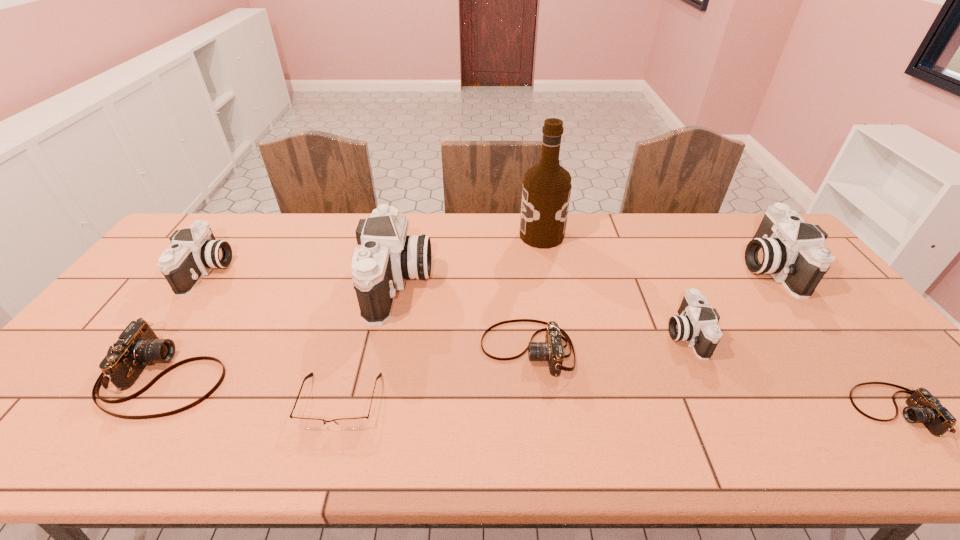
The height and width of the screenshot is (540, 960). Find the location of `vacant space situated on the front of the rightmost black camera`. vacant space situated on the front of the rightmost black camera is located at coordinates 812,324.

This screenshot has height=540, width=960. Find the location of `free space located on the right of the leftmost black camera`. free space located on the right of the leftmost black camera is located at coordinates (279, 272).

Identify the location of free space located 0.390m on the back of the fourth tallest camera. (637, 231).

You are a GUI agent. You are given a task and a screenshot of the screen. Output one action in this format:
    pyautogui.click(x=<x>, y=<y>)
    Task: Click on the vacant space located on the front-facing side of the leftmost brown camera
    The image size is (960, 540).
    Given the screenshot: What is the action you would take?
    pyautogui.click(x=295, y=375)

Identify the location of free space located 0.260m on the front-facing side of the third shortest object. This screenshot has height=540, width=960. (381, 349).

This screenshot has height=540, width=960. What are the coordinates of `vacant space located 0.290m on the front-facing side of the third shortest object` in the screenshot? It's located at (370, 349).

Locate an element on the screen. The image size is (960, 540). vacant region located on the front-facing side of the third shortest object is located at coordinates (416, 349).

You are a GUI agent. You are given a task and a screenshot of the screen. Output one action in this format:
    pyautogui.click(x=<x>, y=<y>)
    Task: Click on the vacant region located 0.060m on the front-facing side of the black spectacles
    Image resolution: width=960 pixels, height=540 pixels.
    Given the screenshot: What is the action you would take?
    pyautogui.click(x=324, y=457)

I want to click on alcohol present at the far edge, so click(x=546, y=191).

At what (x,y) coordinates should I click in order to perform the action: click on object that is positioned at the near edge. Please return your answer as a coordinate pair (x, y). Looking at the image, I should click on (311, 423).